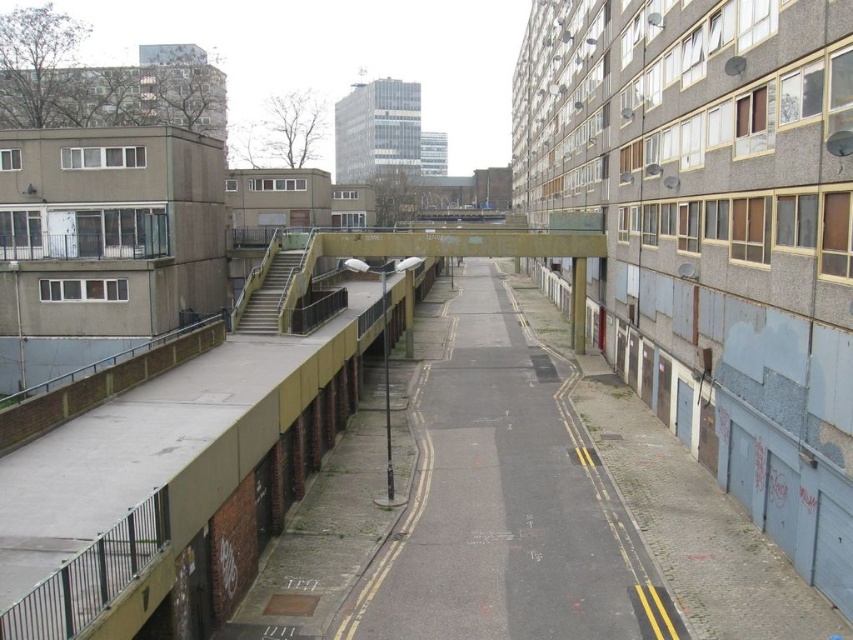
Does asphalt road at center appear over concrete staircase at center-left?

No.

Is asphalt road at center to the left of concrete staircase at center-left from the viewer's perspective?

In fact, asphalt road at center is to the right of concrete staircase at center-left.

Describe the element at coordinates (505, 502) in the screenshot. Image resolution: width=853 pixels, height=640 pixels. I see `asphalt road at center` at that location.

Find the location of `asphalt road at center`. asphalt road at center is located at coordinates (505, 502).